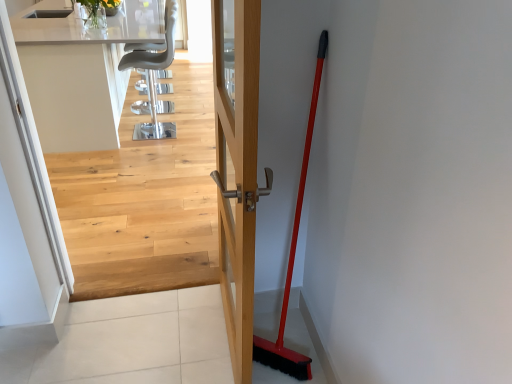
You are a GUI agent. You are given a task and a screenshot of the screen. Output one action in this format:
    pyautogui.click(x=<x>, y=<y>)
    Task: Click on the free point behind red plastic shovel at right
    Image resolution: width=512 pixels, height=384 pixels.
    Given the screenshot: What is the action you would take?
    pyautogui.click(x=283, y=325)